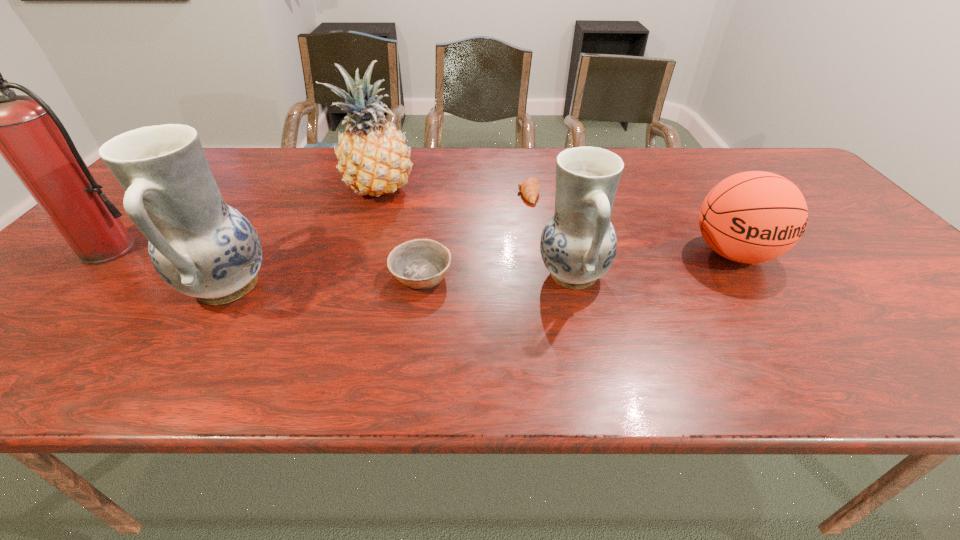
Find the location of a particular element. The width and height of the screenshot is (960, 540). the taller pottery is located at coordinates (200, 246).

The height and width of the screenshot is (540, 960). I want to click on the sixth object from right to left, so click(200, 246).

Where is `the fourth shortest object`? the fourth shortest object is located at coordinates (578, 245).

Locate an element on the screen. The height and width of the screenshot is (540, 960). the right pottery is located at coordinates (578, 245).

Where is `pineapple`? This screenshot has width=960, height=540. pineapple is located at coordinates (373, 158).

This screenshot has width=960, height=540. I want to click on the rightmost object, so click(x=752, y=217).

Where is `the fifth tallest object`? Image resolution: width=960 pixels, height=540 pixels. the fifth tallest object is located at coordinates (752, 217).

At what (x,y) coordinates should I click in order to perform the action: click on the second shortest object. Please return your answer as a coordinate pair (x, y). Looking at the image, I should click on (421, 263).

This screenshot has width=960, height=540. Identify the location of the leftmost object. (24, 130).

Image resolution: width=960 pixels, height=540 pixels. What are the coordinates of `fire extinguisher` in the screenshot? It's located at (24, 130).